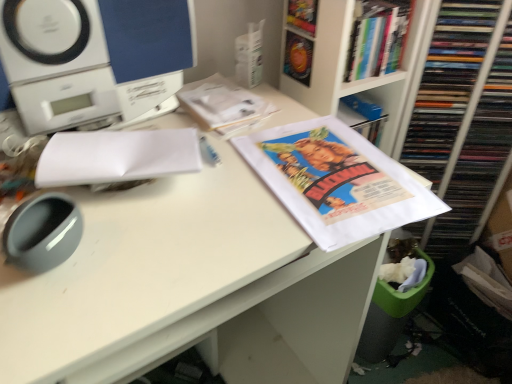
Question: Is white paper at upper center, marked as the second book in a top-to-bottom arrangement, beside white plastic speaker at upper left?

Choices:
 (A) yes
 (B) no

Answer: (B)

Question: From the image's perspective, is white paper at upper center, the first book when ordered from left to right, below white plastic speaker at upper left?

Choices:
 (A) no
 (B) yes

Answer: (B)

Question: Does white paper at upper center, marked as the 2th book in a right-to-left arrangement, have a lesser width compared to white plastic speaker at upper left?

Choices:
 (A) no
 (B) yes

Answer: (A)

Question: Can you confirm if white paper at upper center, the first book when ordered from left to right, is bigger than white plastic speaker at upper left?

Choices:
 (A) yes
 (B) no

Answer: (B)

Question: Does white paper at upper center, marked as the second book in a top-to-bottom arrangement, come behind white plastic speaker at upper left?

Choices:
 (A) no
 (B) yes

Answer: (B)

Question: Is hardcover book at upper right, which is the second book in left-to-right order, inside or outside of white paper at upper center, the first book when ordered from left to right?

Choices:
 (A) outside
 (B) inside

Answer: (A)

Question: Looking at the image, does hardcover book at upper right, which is the first book in top-to-bottom order, seem bigger or smaller compared to white paper at upper center, marked as the second book in a top-to-bottom arrangement?

Choices:
 (A) big
 (B) small

Answer: (A)

Question: From the image's perspective, is hardcover book at upper right, which is the first book in top-to-bottom order, above or below white paper at upper center, which appears as the first book when ordered from the bottom?

Choices:
 (A) below
 (B) above

Answer: (B)

Question: In the image, is hardcover book at upper right, which is the first book in top-to-bottom order, on the left side or the right side of white paper at upper center, which appears as the first book when ordered from the bottom?

Choices:
 (A) left
 (B) right

Answer: (B)

Question: In the image, is hardcover book at upper right, which is the second book in left-to-right order, positioned in front of or behind matte paper poster at center?

Choices:
 (A) front
 (B) behind

Answer: (B)

Question: Considering the relative positions of hardcover book at upper right, the first book viewed from the right, and matte paper poster at center in the image provided, is hardcover book at upper right, the first book viewed from the right, to the left or to the right of matte paper poster at center?

Choices:
 (A) right
 (B) left

Answer: (A)

Question: From their relative heights in the image, would you say hardcover book at upper right, the first book viewed from the right, is taller or shorter than matte paper poster at center?

Choices:
 (A) tall
 (B) short

Answer: (A)

Question: From a real-world perspective, is hardcover book at upper right, which is the second book in left-to-right order, physically located above or below matte paper poster at center?

Choices:
 (A) below
 (B) above

Answer: (B)

Question: In terms of size, does white paper at center appear bigger or smaller than white paper at upper center, marked as the second book in a top-to-bottom arrangement?

Choices:
 (A) small
 (B) big

Answer: (B)

Question: From the image's perspective, is white paper at center positioned above or below white paper at upper center, which appears as the first book when ordered from the bottom?

Choices:
 (A) above
 (B) below

Answer: (B)